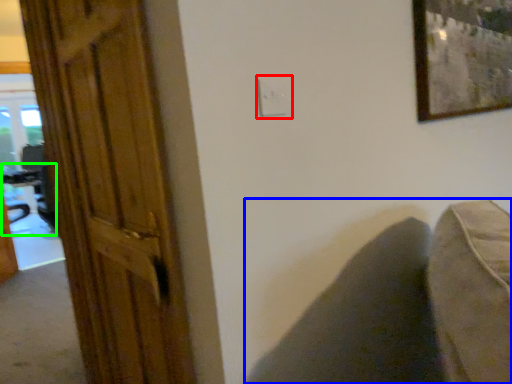
Question: Estimate the real-world distances between objects in this image. Which object is closer to electric outlet (highlighted by a red box), swivel chair (highlighted by a blue box) or table (highlighted by a green box)?

Choices:
 (A) swivel chair
 (B) table

Answer: (A)